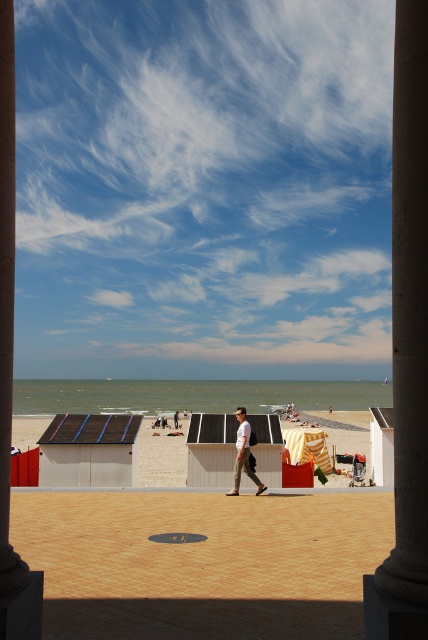
You are standing at the entrance of the walkway and want to find the white wood beach hut at center. According to the coordinates provided, in which direction should you walk to reach it?

The white wood beach hut at center is located at coordinates point (211, 449). Since you are at the entrance of the walkway, you should walk forward towards the center of the beach to reach it.

You are planning to set up a new bench between the white wood beach hut at center and the beige fabric beach hut at center. The bench requires a minimum of 5 meters of space. Can you fit the bench between them?

The white wood beach hut at center is 5.45 meters from beige fabric beach hut at center, so yes, the bench can be placed between them as the distance is sufficient.

From the picture: You are standing at the entrance of the walkway and want to locate the white wood beach hut at center. According to the coordinates provided, in which direction should you walk to reach it?

The white wood beach hut at center is located at coordinates point (x=211, y=449). Since the x coordinate is 0.703, which is greater than 0.5, you should walk towards the right side of the walkway to reach it.